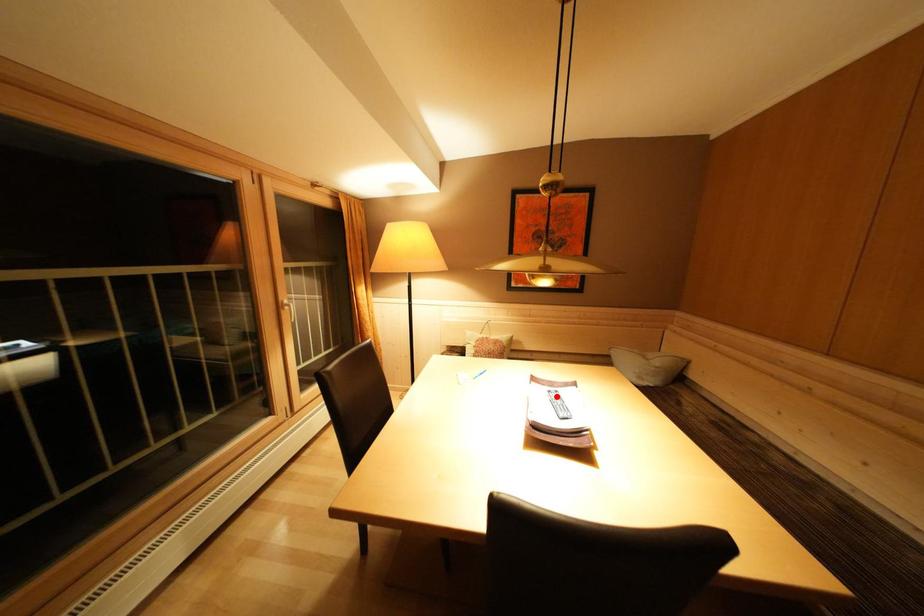
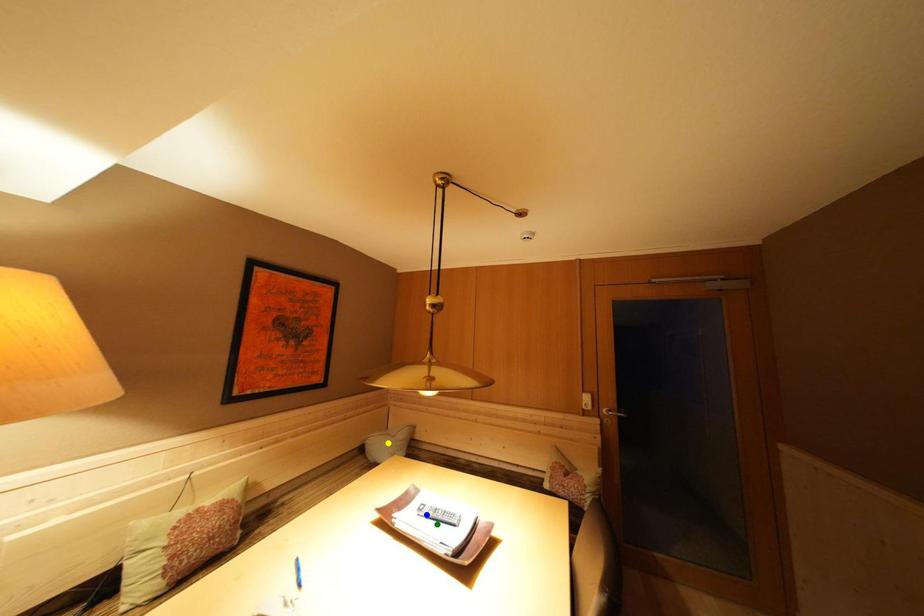
Question: I am providing you with two images of the same scene from different viewpoints. A red point is marked on the first image. You are given multiple points on the second image. Which point in image 2 is actually the same real-world point as the red point in image 1?

Choices:
 (A) green point
 (B) blue point
 (C) yellow point

Answer: (B)